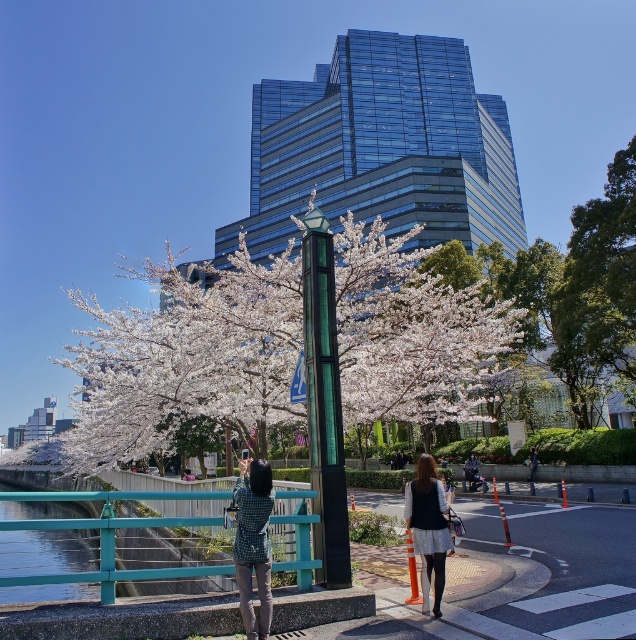
You are a photographer trying to capture the white blossoms at center and the clear glass waterway at lower left in the same frame. Based on their sizes, which one would appear larger in your photo?

The white blossoms at center would appear larger in the photo since they are bigger than the clear glass waterway at lower left according to the description.

You are a drone operator trying to fly a drone from point A to point B in this urban scene. Point A is at coordinates point (483, 307) and point B is at coordinates point (429, 484). According to the scene description, which point is closer to the foreground?

Point (429, 484) is closer to the foreground because it is in front of point (483, 307), which is behind it.

You are a photographer standing at the teal railing with a smartphone. You want to capture a clear photo of the white blossoms at center. Considering the distance between you and the blossoms, will you be able to take a clear photo without moving closer?

The white blossoms at center is 6.42 meters away from camera. Since smartphones can focus on subjects beyond 6 meters, you can take a clear photo without moving closer.